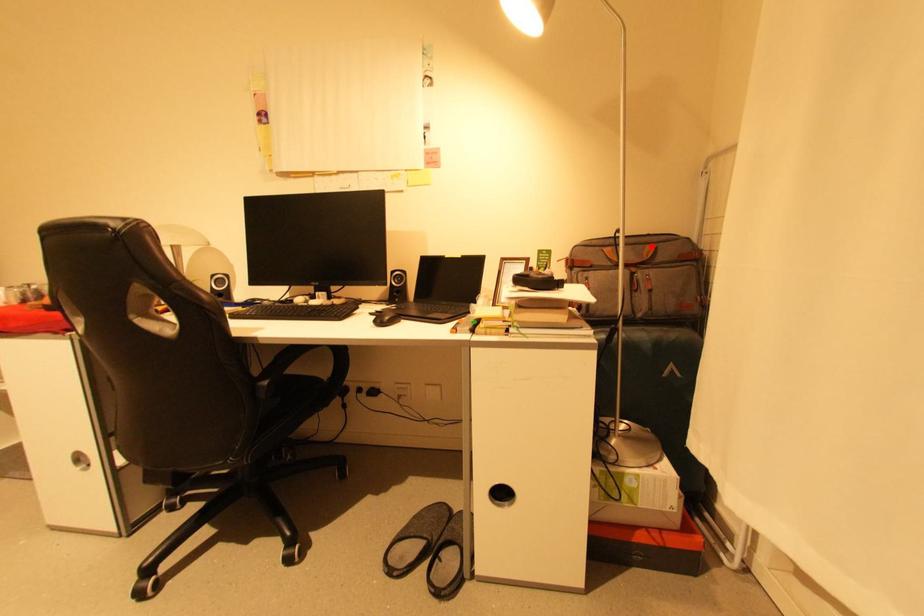
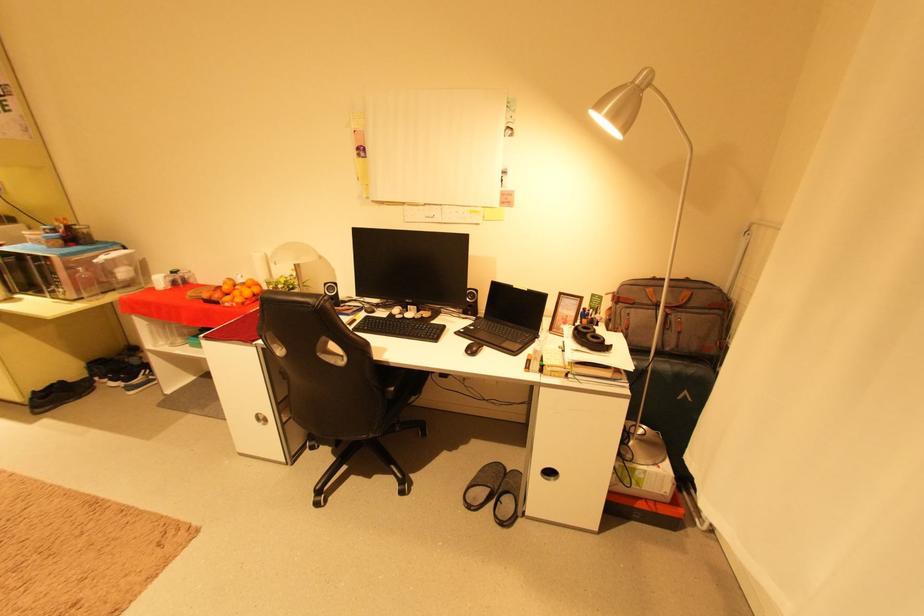
Where in the second image is the point corresponding to the highlighted location from the first image?

(688, 290)